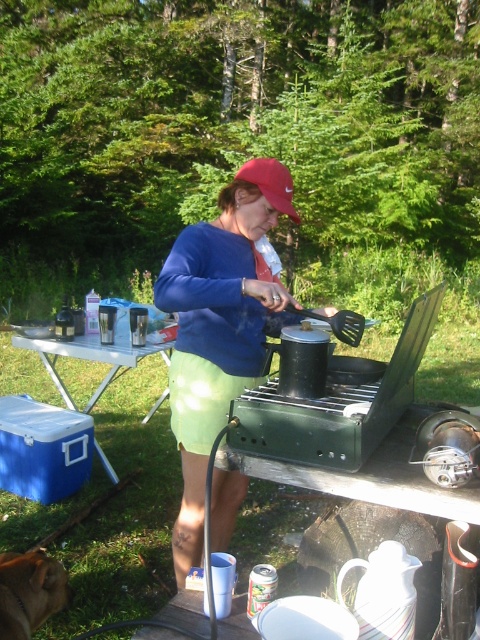
Is blue fabric shirt at center wider than brown fur dog at lower left?

Indeed, blue fabric shirt at center has a greater width compared to brown fur dog at lower left.

At what (x,y) coordinates should I click in order to perform the action: click on blue fabric shirt at center. Please return your answer as a coordinate pair (x, y). Image resolution: width=480 pixels, height=640 pixels. Looking at the image, I should click on (219, 326).

Which is more to the right, brown fur dog at lower left or red matte baseball cap at center?

Positioned to the right is red matte baseball cap at center.

Is brown fur dog at lower left shorter than red matte baseball cap at center?

Yes, brown fur dog at lower left is shorter than red matte baseball cap at center.

At what (x,y) coordinates should I click in order to perform the action: click on brown fur dog at lower left. Please return your answer as a coordinate pair (x, y). The width and height of the screenshot is (480, 640). Looking at the image, I should click on (29, 593).

At what (x,y) coordinates should I click in order to perform the action: click on brown fur dog at lower left. Please return your answer as a coordinate pair (x, y). Looking at the image, I should click on (29, 593).

Which is above, white plastic picnic table at lower left or brown fur dog at lower left?

white plastic picnic table at lower left is higher up.

Does white plastic picnic table at lower left have a greater width compared to brown fur dog at lower left?

Yes, white plastic picnic table at lower left is wider than brown fur dog at lower left.

Image resolution: width=480 pixels, height=640 pixels. Describe the element at coordinates (93, 355) in the screenshot. I see `white plastic picnic table at lower left` at that location.

At what (x,y) coordinates should I click in order to perform the action: click on white plastic picnic table at lower left. Please return your answer as a coordinate pair (x, y). The image size is (480, 640). Looking at the image, I should click on (93, 355).